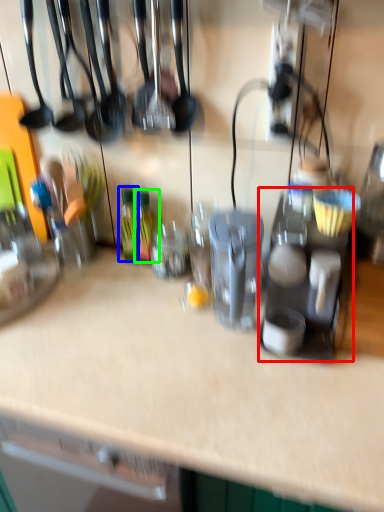
Question: Based on their relative distances, which object is farther from appliance (highlighted by a red box)? Choose from bottle (highlighted by a blue box) and bottle (highlighted by a green box).

Choices:
 (A) bottle
 (B) bottle

Answer: (A)